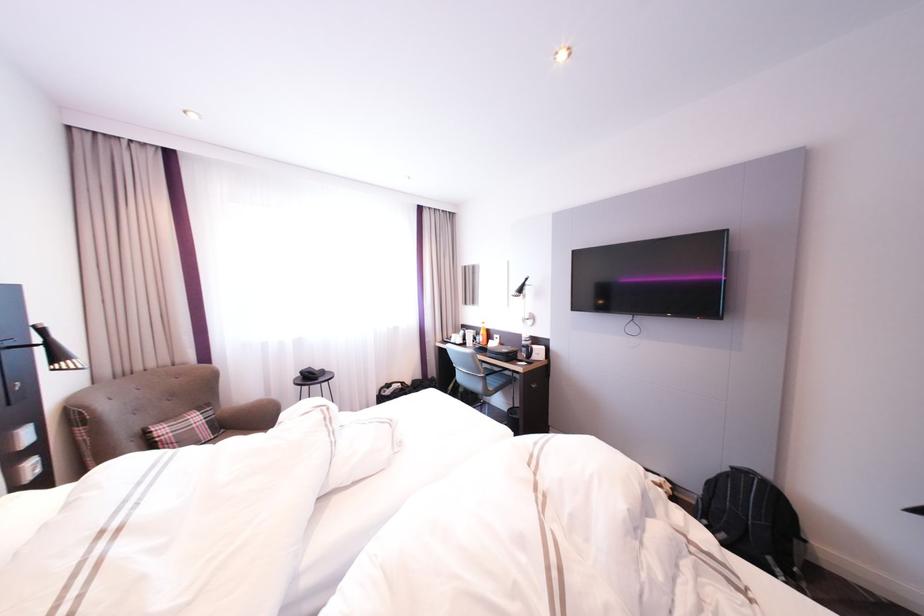
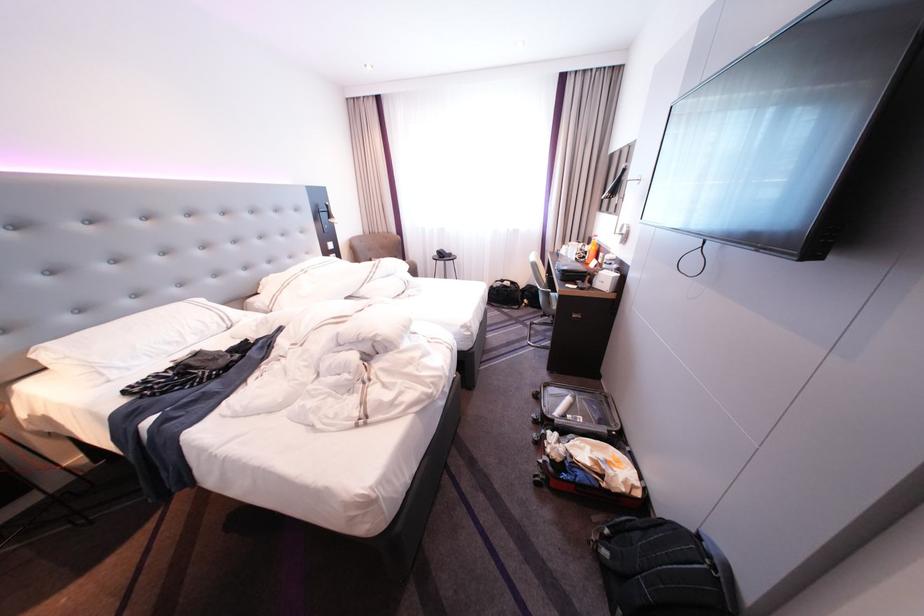
Question: I am providing you with two images of the same scene from different viewpoints. Please identify which objects are invisible in image2.

Choices:
 (A) green trash bin
 (B) white chair sitting surface
 (C) brown chair sitting surface
 (D) suitcase handle

Answer: (C)